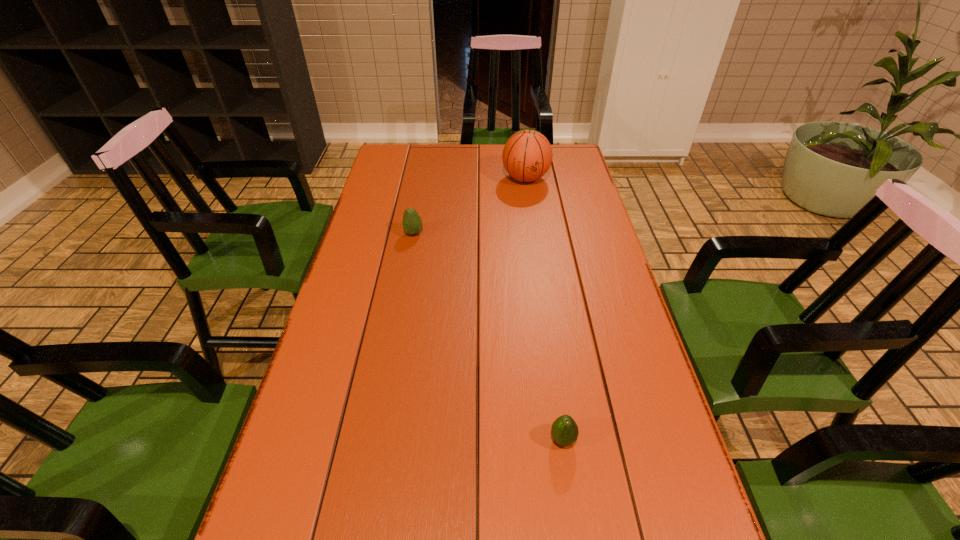
Locate an element on the screen. vacant space that satisfies the following two spatial constraints: 1. on the back side of the tallest object; 2. on the left side of the nearest object is located at coordinates (525, 179).